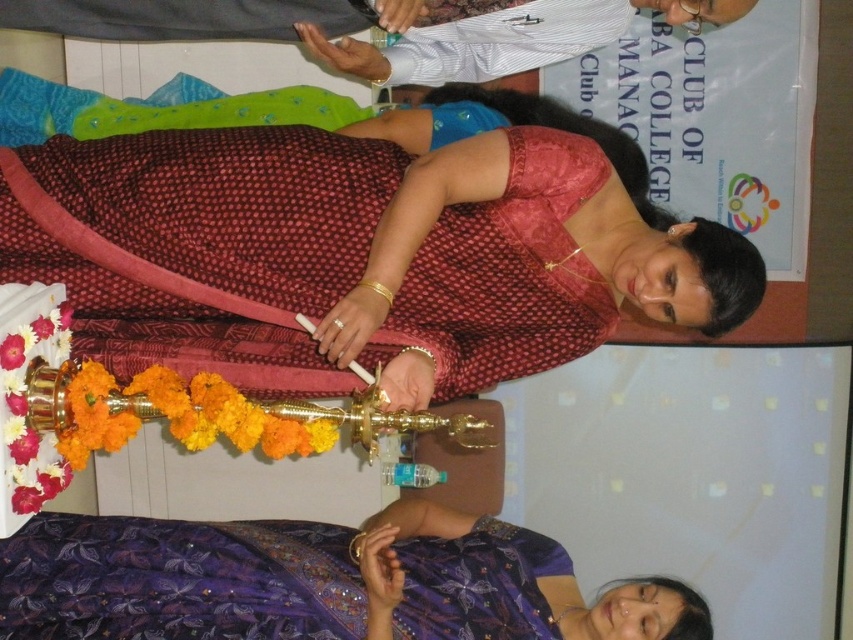
Between maroon printed saree at center and purple sequined saree at lower left, which one has more height?

With more height is maroon printed saree at center.

Who is more forward, [546,225] or [544,552]?

Point [546,225] is in front.

What are the coordinates of `maroon printed saree at center` in the screenshot? It's located at (200, 244).